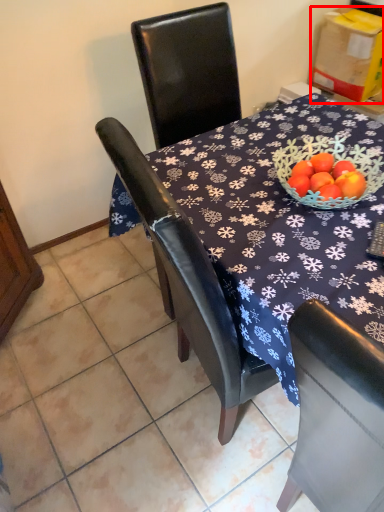
Question: From the image's perspective, considering the relative positions of cardboard box (annotated by the red box) and tile in the image provided, where is cardboard box (annotated by the red box) located with respect to the staircase?

Choices:
 (A) above
 (B) below

Answer: (A)